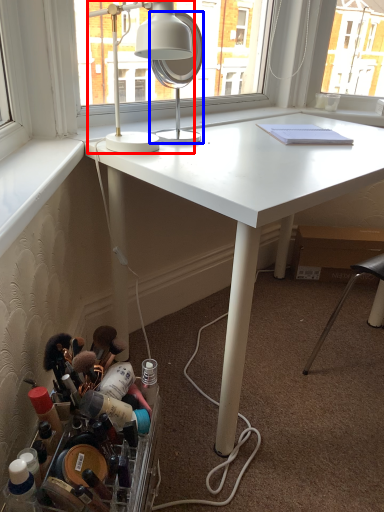
Question: Which object is closer to the camera taking this photo, lamp (highlighted by a red box) or mirror (highlighted by a blue box)?

Choices:
 (A) lamp
 (B) mirror

Answer: (A)